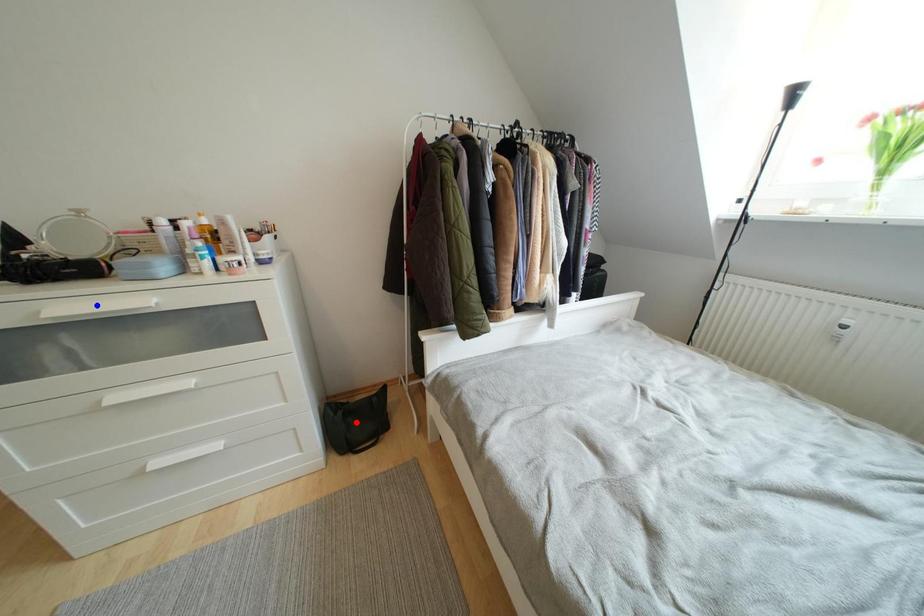
Question: Two points are marked on the image. Which point is closer to the camera?

Choices:
 (A) Blue point is closer.
 (B) Red point is closer.

Answer: (A)